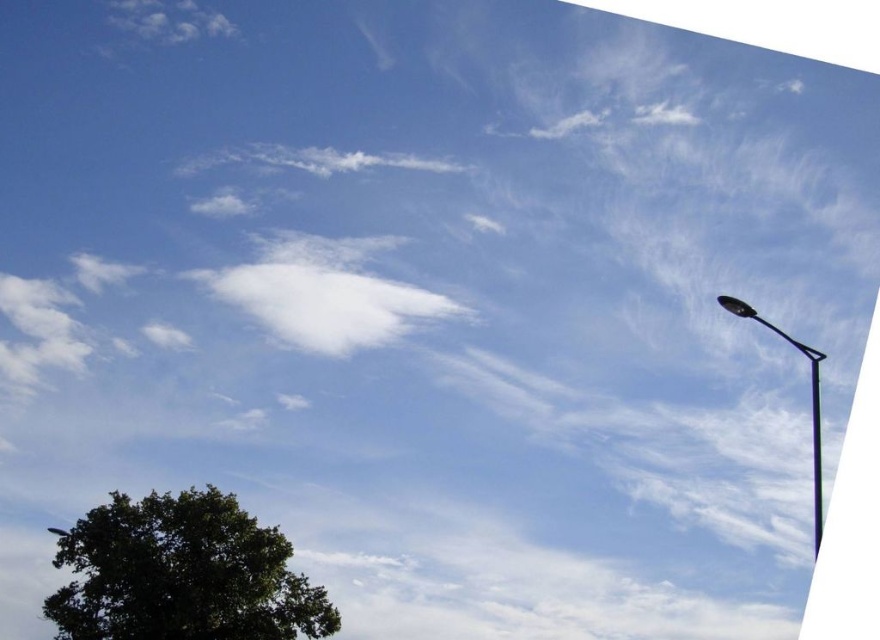
You are a pedestrian standing in front of the black metal street light at right. Looking towards the green leafy tree at lower left, which direction should you walk to reach it?

The green leafy tree at lower left is to the left of the black metal street light at right, so you should walk towards the left to reach it.

You are a bird flying in the sky scene. You see the point marked at coordinates (182, 573). What object is located at that point?

The point at coordinates (182, 573) indicates the green leafy tree at lower left.